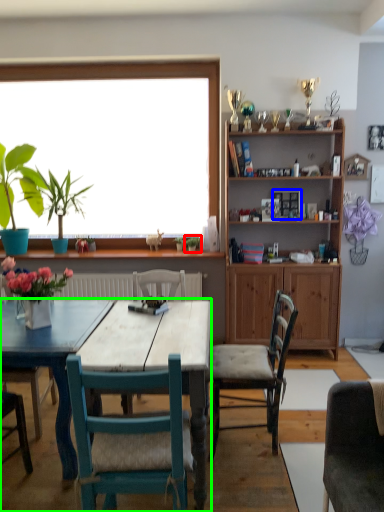
Question: Which object is positioned farthest from plant (highlighted by a red box)? Select from picture frame (highlighted by a blue box) and kitchen & dining room table (highlighted by a green box).

Choices:
 (A) picture frame
 (B) kitchen & dining room table

Answer: (B)